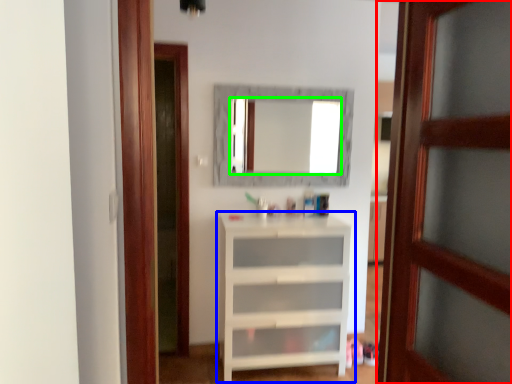
Question: Considering the real-world distances, which object is closest to door (highlighted by a red box)? shelf (highlighted by a blue box) or mirror (highlighted by a green box).

Choices:
 (A) shelf
 (B) mirror

Answer: (A)